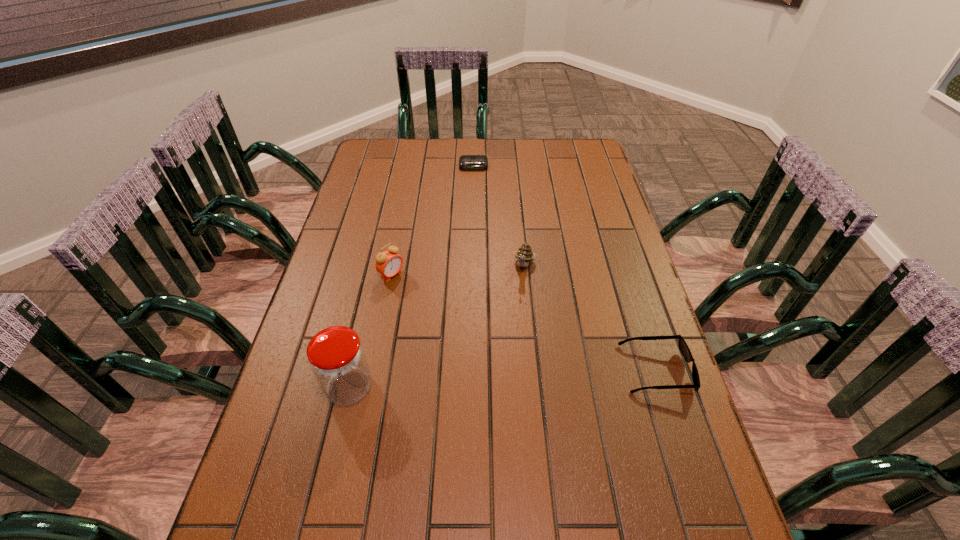
Locate an element on the screen. The height and width of the screenshot is (540, 960). jar is located at coordinates (337, 358).

Where is `the rightmost object`? the rightmost object is located at coordinates (683, 346).

Identify the location of the second shortest object. The height and width of the screenshot is (540, 960). (683, 346).

Locate an element on the screen. snail is located at coordinates (524, 254).

This screenshot has height=540, width=960. Identify the location of the farthest object. (466, 162).

What are the coordinates of `the right alarm clock` in the screenshot? It's located at (466, 162).

Identify the location of the left alarm clock. This screenshot has width=960, height=540. (388, 263).

At what (x,y) coordinates should I click in order to perform the action: click on the nearer alarm clock. Please return your answer as a coordinate pair (x, y). This screenshot has height=540, width=960. Looking at the image, I should click on pyautogui.click(x=388, y=263).

At what (x,y) coordinates should I click in order to perform the action: click on vacant space located 0.260m on the right of the jar. Please return your answer as a coordinate pair (x, y). The width and height of the screenshot is (960, 540). Looking at the image, I should click on (485, 387).

The width and height of the screenshot is (960, 540). Find the location of `vacant region located 0.100m on the face of the snail`. vacant region located 0.100m on the face of the snail is located at coordinates (516, 304).